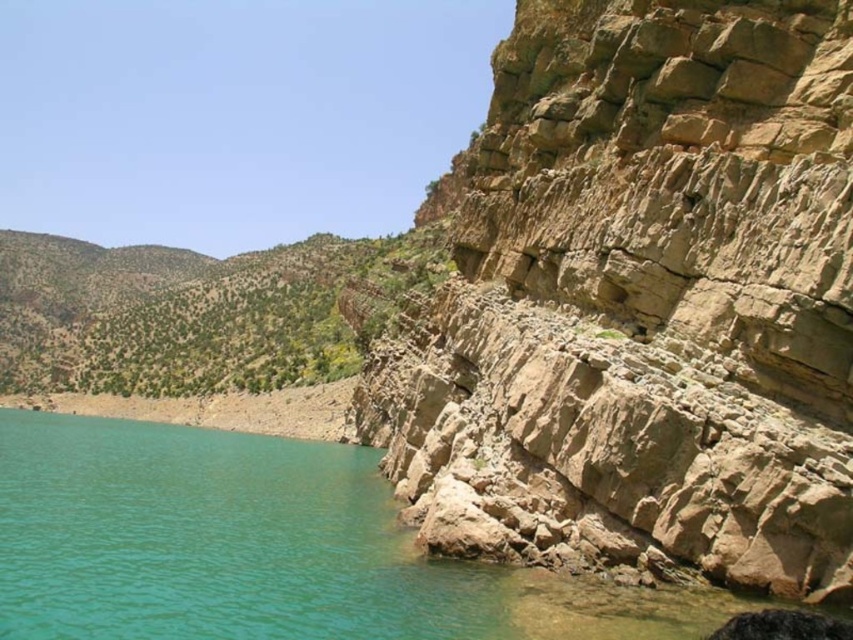
Question: Among these points, which one is nearest to the camera?

Choices:
 (A) click(113, 518)
 (B) click(596, 96)

Answer: (B)

Question: Which point is closer to the camera?

Choices:
 (A) (335, 595)
 (B) (821, 115)

Answer: (B)

Question: Does brown rough rock at right have a larger size compared to turquoise water at lower left?

Choices:
 (A) yes
 (B) no

Answer: (A)

Question: Among these objects, which one is farthest from the camera?

Choices:
 (A) turquoise water at lower left
 (B) brown rough rock at right

Answer: (A)

Question: From the image, what is the correct spatial relationship of brown rough rock at right in relation to turquoise water at lower left?

Choices:
 (A) above
 (B) below

Answer: (A)

Question: Is brown rough rock at right positioned behind turquoise water at lower left?

Choices:
 (A) yes
 (B) no

Answer: (B)